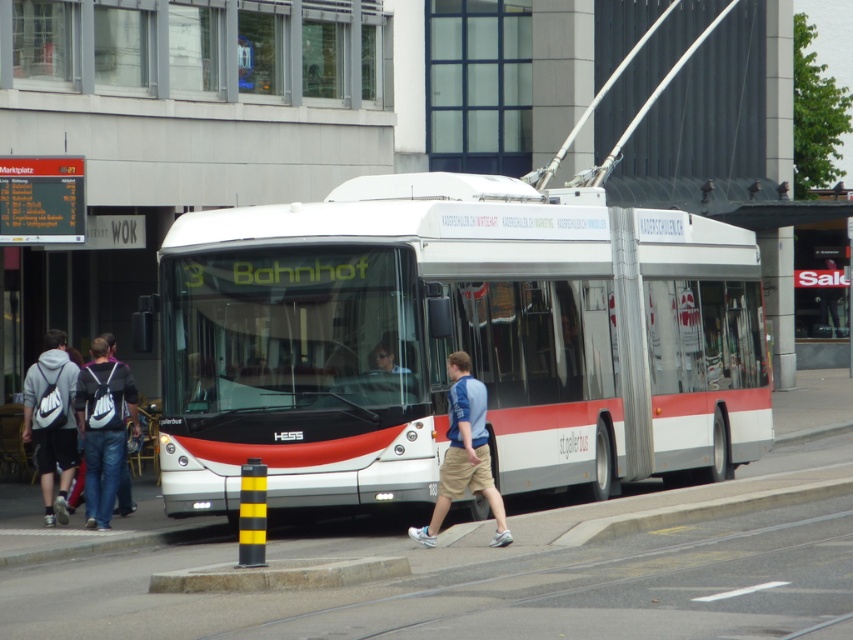
You are a delivery person trying to load a light blue jersey at center into the back of the white metallic bus at center. Can you fit the jersey vertically inside the bus?

The white metallic bus at center is much taller than the light blue jersey at center, so yes, the jersey can be fit vertically inside the bus.

You are a pedestrian standing on the white concrete pavement at center. You want to pick up the gray fabric backpack at left. Can you reach it without moving from your current position?

The white concrete pavement at center is located below gray fabric backpack at left, meaning the backpack is above the pavement. Since you are standing on the pavement, you can reach up to pick up the gray fabric backpack at left.